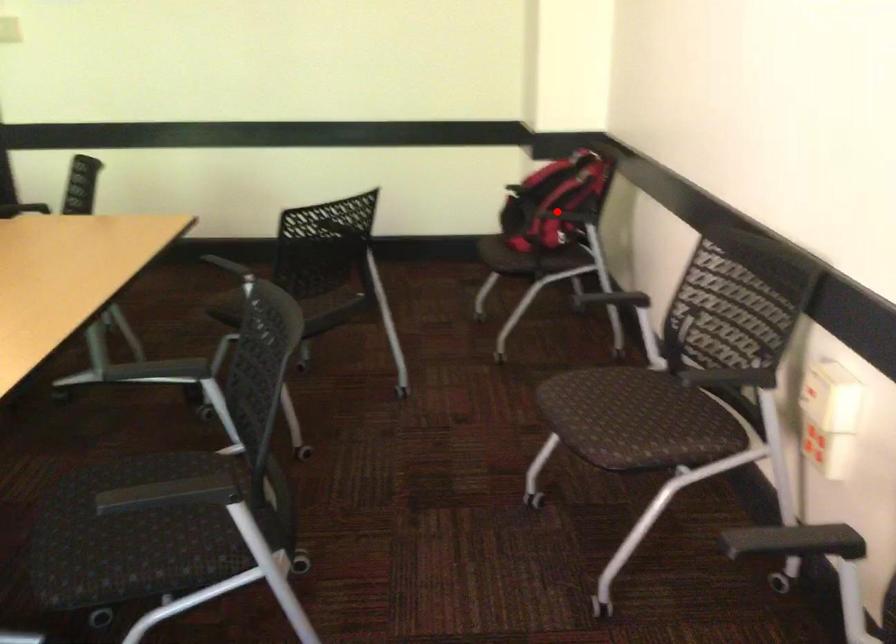
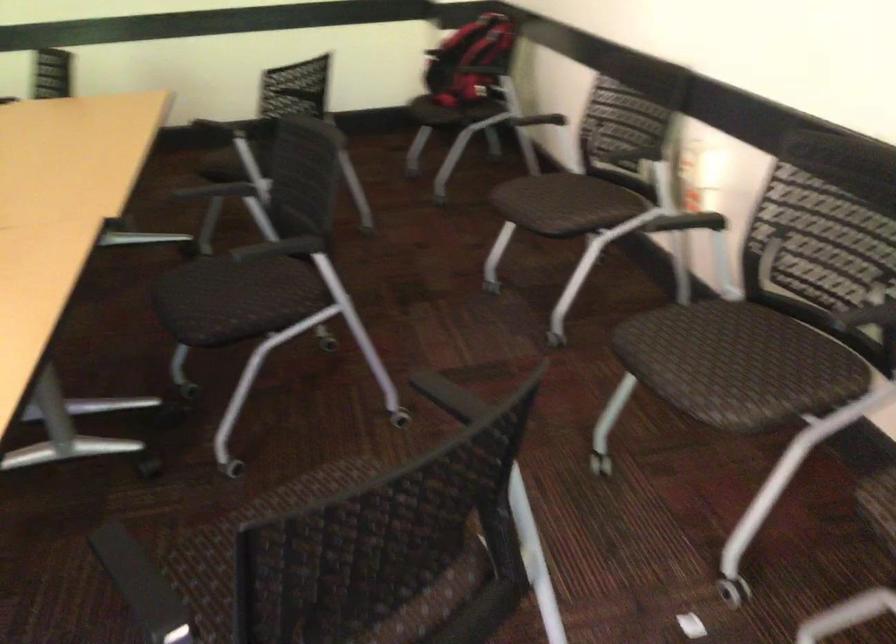
Question: I am providing you with two images of the same scene from different viewpoints. Given a red point in image1, look at the same physical point in image2. Is it:

Choices:
 (A) Closer to the viewpoint
 (B) Farther from the viewpoint

Answer: (B)